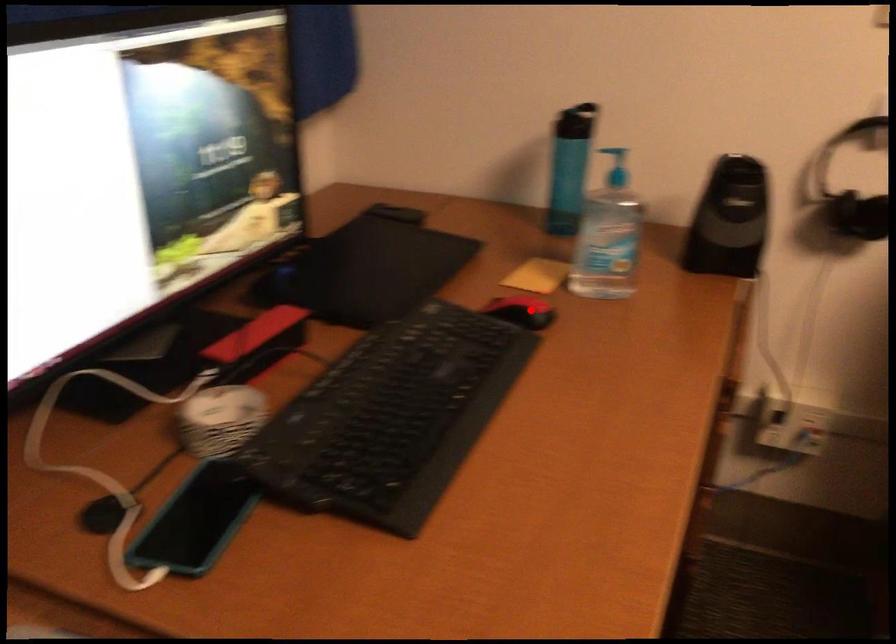
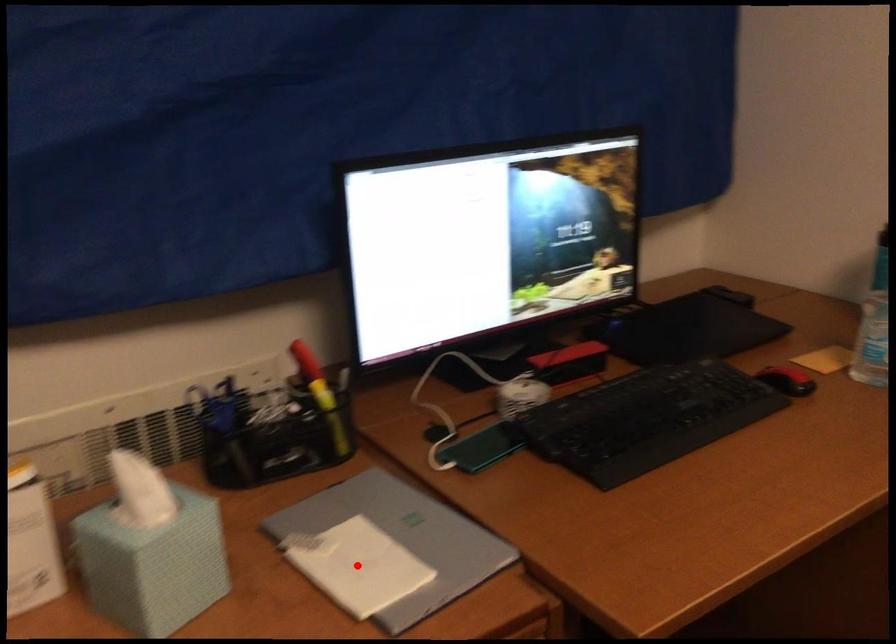
I am providing you with two images of the same scene from different viewpoints. A red point is marked on the first image and another point is marked on the second image. Does the point marked in image1 correspond to the same location as the one in image2?

No